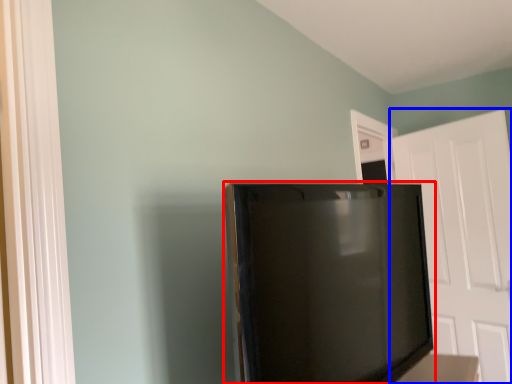
Question: Among these objects, which one is farthest to the camera, refrigerator (highlighted by a red box) or door (highlighted by a blue box)?

Choices:
 (A) refrigerator
 (B) door

Answer: (B)